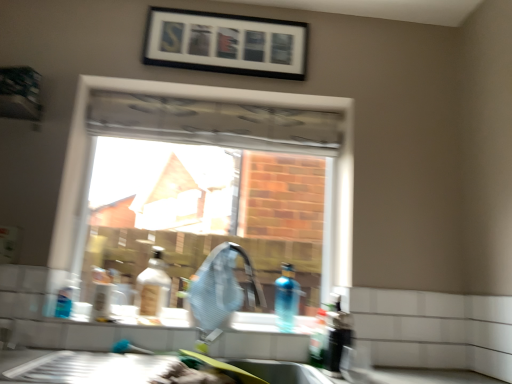
Question: Based on their sizes in the image, would you say black matte picture frame at upper center is bigger or smaller than translucent blue bottle at lower right, the fifth bottle from the left?

Choices:
 (A) small
 (B) big

Answer: (B)

Question: Is point (286, 49) closer or farther from the camera than point (338, 294)?

Choices:
 (A) closer
 (B) farther

Answer: (B)

Question: Which object is the farthest from the matte plastic bottle at center, which ranks as the 4th bottle in right-to-left order?

Choices:
 (A) matte silver faucet at center
 (B) clear glass window at center
 (C) blue translucent bottle at sink, the 3th bottle positioned from the left
 (D) black matte picture frame at upper center
 (E) translucent plastic bottle at sink, the 4th bottle viewed from the left

Answer: (D)

Question: Estimate the real-world distances between objects in this image. Which object is closer to the black matte picture frame at upper center?

Choices:
 (A) clear glass window at center
 (B) translucent plastic bottle at sink, acting as the second bottle starting from the right
 (C) matte silver faucet at center
 (D) matte plastic bottle at center, which ranks as the 4th bottle in right-to-left order
 (E) translucent blue bottle at lower right, the 1th bottle from the right

Answer: (A)